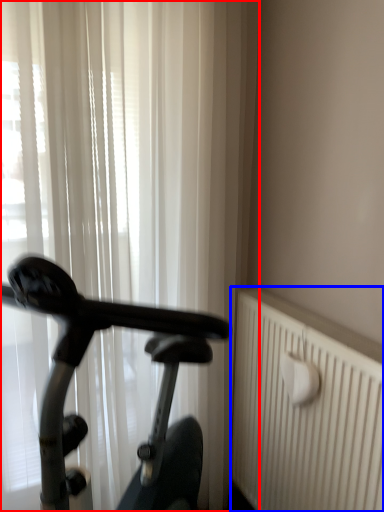
Question: Which object is further to the camera taking this photo, curtain (highlighted by a red box) or radiator (highlighted by a blue box)?

Choices:
 (A) curtain
 (B) radiator

Answer: (A)